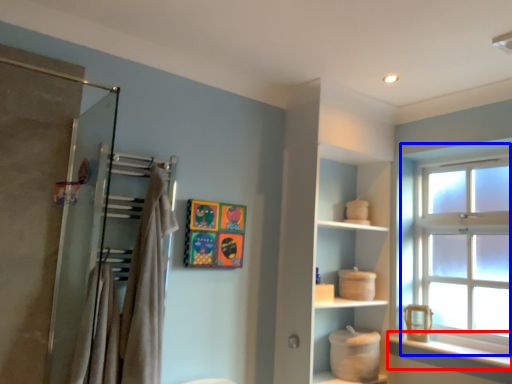
Question: Among these objects, which one is farthest to the camera, window sill (highlighted by a red box) or window (highlighted by a blue box)?

Choices:
 (A) window sill
 (B) window

Answer: (B)